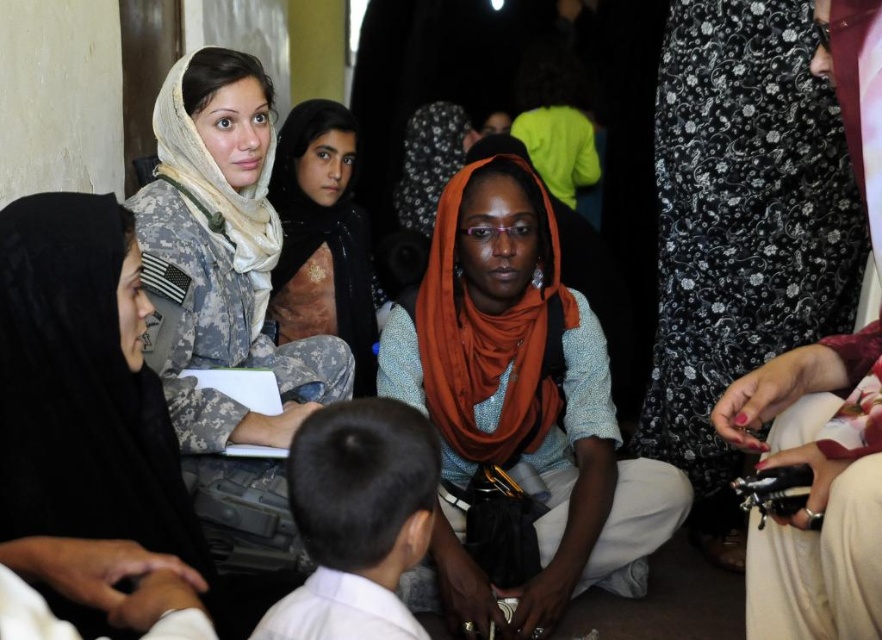
From the picture: You are standing in the room and want to move from point A to point B. Point A is at coordinate point point (213, 131) and point B is at coordinate point (371, 605). Which point is closer to you?

Point (213, 131) is closer to you because it is further to the viewer than point (371, 605).

What is located at the coordinates point (221,257) in the image?

The camouflage fabric uniform at upper left is located at point (221,257).

You are trying to decide which item to grab first from the center area. Based on their sizes, which object is wider, the orange fabric scarf at center or the matte khaki uniform at center?

The orange fabric scarf at center is wider than the matte khaki uniform at center according to the description.